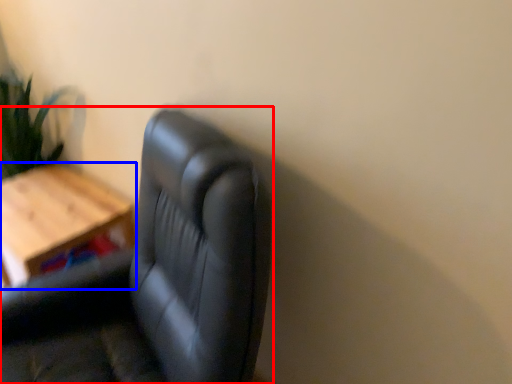
Question: Which object is further to the camera taking this photo, chair (highlighted by a red box) or table (highlighted by a blue box)?

Choices:
 (A) chair
 (B) table

Answer: (B)